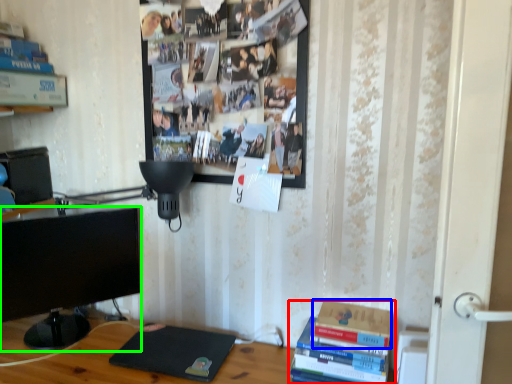
Question: Which object is positioned farthest from book (highlighted by a red box)? Select from paperback book (highlighted by a blue box) and television (highlighted by a green box).

Choices:
 (A) paperback book
 (B) television

Answer: (B)